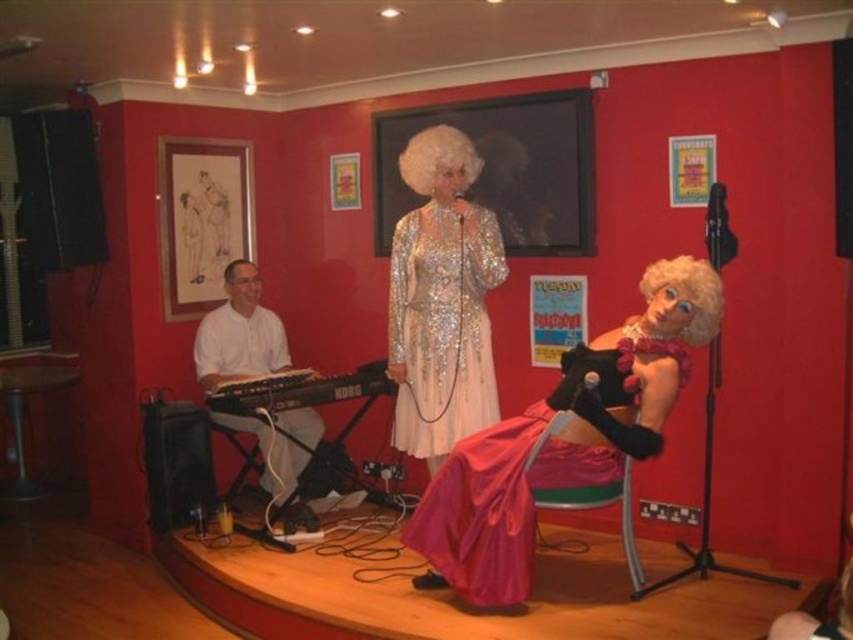
Question: Can you confirm if shiny silver dress at center is positioned below blonde synthetic wig at center?

Choices:
 (A) no
 (B) yes

Answer: (B)

Question: Which point is closer to the camera?

Choices:
 (A) white matte keyboard at left
 (B) black plastic keyboard at left
 (C) shiny silver dress at center
 (D) white curly wig at upper center

Answer: (C)

Question: Does shiny pink dress at center lie in front of shiny silver dress at center?

Choices:
 (A) yes
 (B) no

Answer: (A)

Question: From the image, what is the correct spatial relationship of white matte keyboard at left in relation to blonde synthetic wig at center?

Choices:
 (A) right
 (B) left

Answer: (B)

Question: Among these points, which one is farthest from the camera?

Choices:
 (A) (579, 474)
 (B) (383, 365)

Answer: (B)

Question: Which point is closer to the camera?

Choices:
 (A) black plastic keyboard at left
 (B) white matte keyboard at left

Answer: (A)